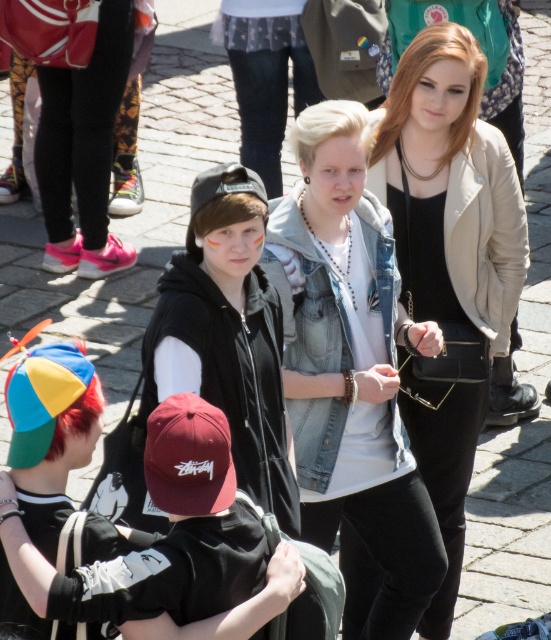
Question: Is denim jacket at center closer to camera compared to black matte hoodie at center?

Choices:
 (A) no
 (B) yes

Answer: (A)

Question: Which is farther from the denim jacket at center?

Choices:
 (A) matte black cap at center
 (B) beige leather jacket at upper right

Answer: (A)

Question: Which point appears closest to the camera in this image?

Choices:
 (A) (24, 481)
 (B) (354, 356)
 (C) (418, 454)

Answer: (A)

Question: Is denim jacket at center thinner than beige leather jacket at upper right?

Choices:
 (A) no
 (B) yes

Answer: (A)

Question: Which is nearer to the beige leather jacket at upper right?

Choices:
 (A) denim jacket at center
 (B) black matte hoodie at center
 (C) matte black cap at center

Answer: (A)

Question: Can you confirm if beige leather jacket at upper right is bigger than black matte hoodie at center?

Choices:
 (A) no
 (B) yes

Answer: (B)